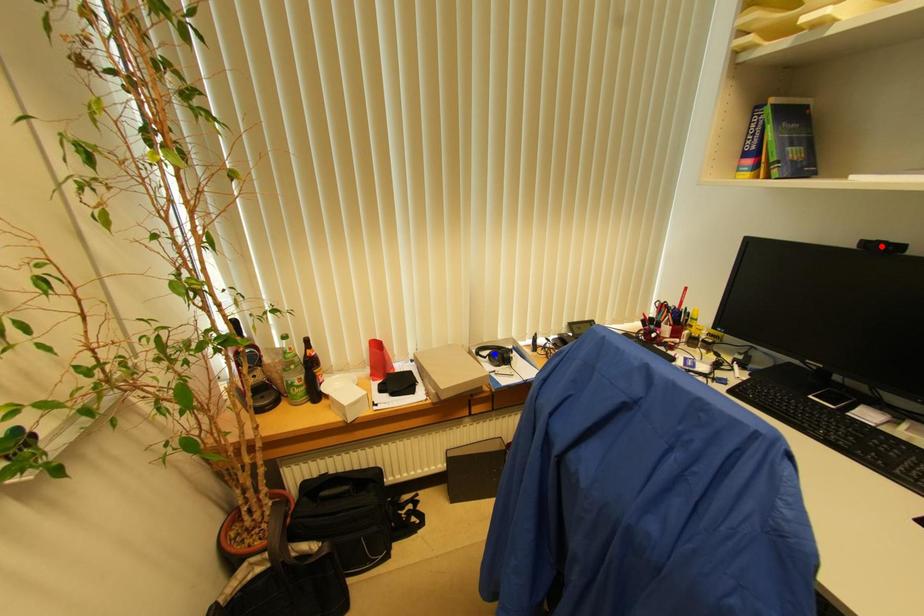
Question: Two points are marked on the image. Which point is closer to the camera?

Choices:
 (A) Blue point is closer.
 (B) Red point is closer.

Answer: (B)